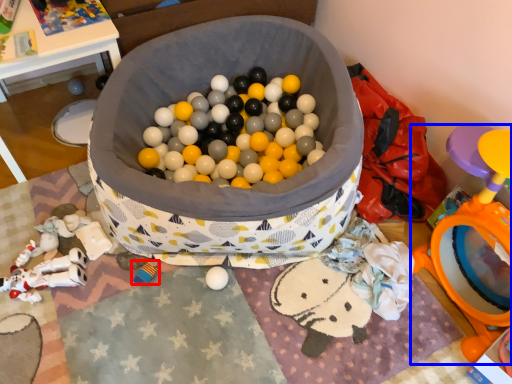
Question: Which object appears closest to the camera in this image, toy (highlighted by a red box) or toy (highlighted by a blue box)?

Choices:
 (A) toy
 (B) toy

Answer: (B)